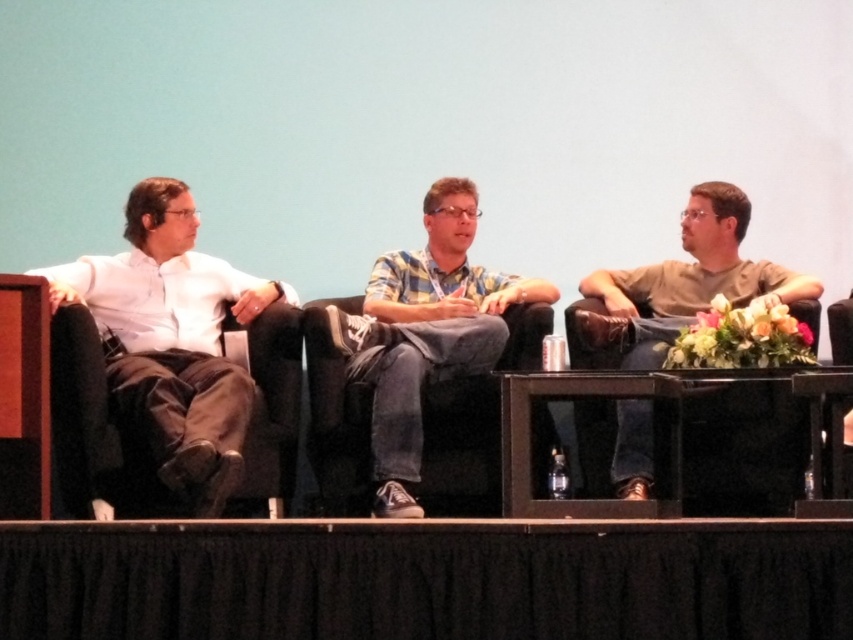
Who is taller, plaid shirt at center or brown cotton shirt at right?

With more height is plaid shirt at center.

Is plaid shirt at center thinner than brown cotton shirt at right?

Indeed, plaid shirt at center has a lesser width compared to brown cotton shirt at right.

Between point (403, 420) and point (715, 218), which one is positioned behind?

Point (715, 218)

Find the location of a particular element. The height and width of the screenshot is (640, 853). plaid shirt at center is located at coordinates (422, 333).

This screenshot has width=853, height=640. Find the location of `white matte shirt at left`. white matte shirt at left is located at coordinates (172, 340).

Is white matte shirt at left bigger than plaid shirt at center?

No, white matte shirt at left is not bigger than plaid shirt at center.

This screenshot has height=640, width=853. What do you see at coordinates (172, 340) in the screenshot?
I see `white matte shirt at left` at bounding box center [172, 340].

You are a GUI agent. You are given a task and a screenshot of the screen. Output one action in this format:
    pyautogui.click(x=<x>, y=<y>)
    Task: Click on the white matte shirt at left
    Image resolution: width=853 pixels, height=640 pixels.
    Given the screenshot: What is the action you would take?
    pyautogui.click(x=172, y=340)

Does white matte shirt at left appear under brown cotton shirt at right?

Yes.

Between point (254, 314) and point (759, 285), which one is positioned behind?

Point (759, 285)

Who is more forward, (x=125, y=220) or (x=577, y=321)?

Point (x=577, y=321) is in front.

Identify the location of white matte shirt at left. The image size is (853, 640). (172, 340).